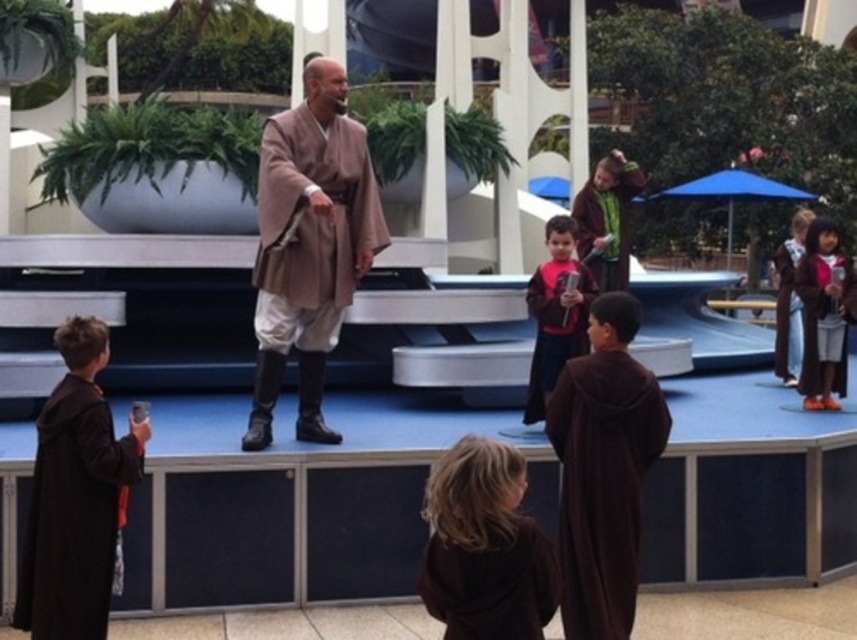
Is black matte robe at lower left thinner than pink fabric shirt at center?

In fact, black matte robe at lower left might be wider than pink fabric shirt at center.

The height and width of the screenshot is (640, 857). In order to click on black matte robe at lower left in this screenshot , I will do `click(73, 515)`.

I want to click on black matte robe at lower left, so click(x=73, y=515).

Where is `black matte robe at lower left`? The width and height of the screenshot is (857, 640). black matte robe at lower left is located at coordinates (73, 515).

Is black matte robe at lower left positioned at the back of brown woolen robe at lower center?

Yes, black matte robe at lower left is behind brown woolen robe at lower center.

Between point (67, 412) and point (456, 604), which one is positioned behind?

The point (67, 412) is behind.

Based on the photo, measure the distance between point (27, 538) and camera.

The distance of point (27, 538) from camera is 21.28 meters.

Find the location of a particular element. The height and width of the screenshot is (640, 857). black matte robe at lower left is located at coordinates (73, 515).

Does black matte robe at lower left appear under brown woolen robe at right?

Yes, black matte robe at lower left is below brown woolen robe at right.

Who is more distant from viewer, (72, 544) or (784, 296)?

The point (784, 296) is more distant.

Find the location of a particular element. The width and height of the screenshot is (857, 640). black matte robe at lower left is located at coordinates (73, 515).

Where is `black matte robe at lower left`? This screenshot has width=857, height=640. black matte robe at lower left is located at coordinates (73, 515).